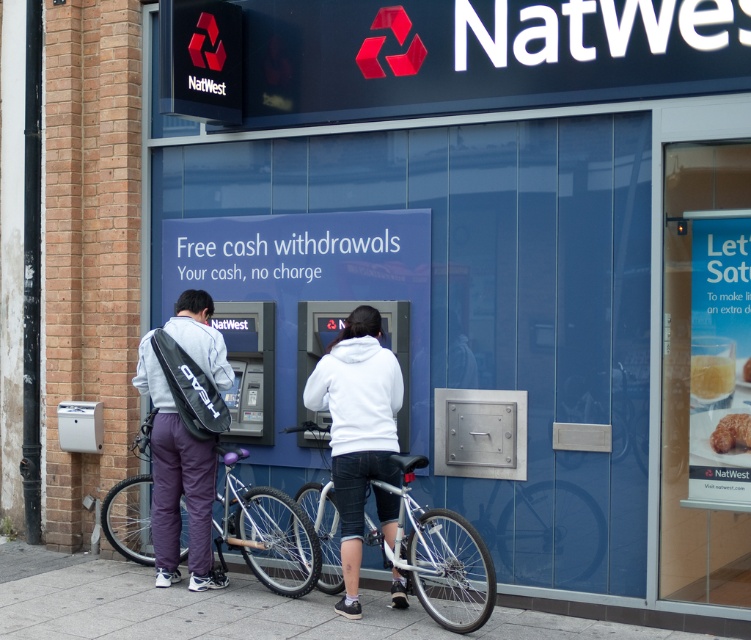
Is gray concrete pavement at lower center to the right of golden crispy croissant at center from the viewer's perspective?

Incorrect, gray concrete pavement at lower center is not on the right side of golden crispy croissant at center.

Can you confirm if gray concrete pavement at lower center is shorter than golden crispy croissant at center?

Indeed, gray concrete pavement at lower center has a lesser height compared to golden crispy croissant at center.

Who is more forward, (323, 616) or (749, 376)?

Positioned in front is point (749, 376).

The width and height of the screenshot is (751, 640). Identify the location of gray concrete pavement at lower center. (228, 608).

Can you confirm if gray concrete pavement at lower center is positioned above gray fabric backpack at lower left?

Incorrect, gray concrete pavement at lower center is not positioned above gray fabric backpack at lower left.

Where is `gray concrete pavement at lower center`? Image resolution: width=751 pixels, height=640 pixels. gray concrete pavement at lower center is located at coordinates pos(228,608).

Is the position of purple matte bicycle at center less distant than that of gray fabric backpack at lower left?

No, it is not.

Based on the photo, measure the distance between point (276, 512) and camera.

Point (276, 512) and camera are 7.72 meters apart.

Measure the distance between purple matte bicycle at center and camera.

purple matte bicycle at center and camera are 6.94 meters apart from each other.

Image resolution: width=751 pixels, height=640 pixels. Find the location of `purple matte bicycle at center`. purple matte bicycle at center is located at coordinates (267, 531).